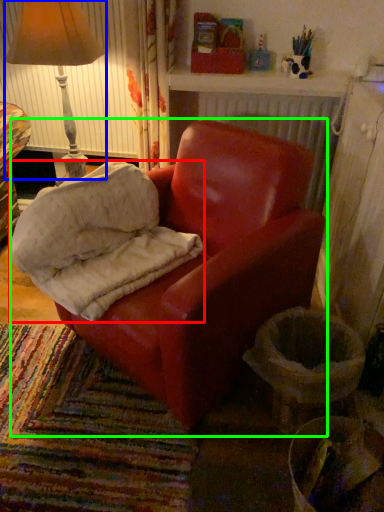
Question: Based on their relative distances, which object is farther from material (highlighted by a red box)? Choose from lamp (highlighted by a blue box) and chair (highlighted by a green box).

Choices:
 (A) lamp
 (B) chair

Answer: (A)